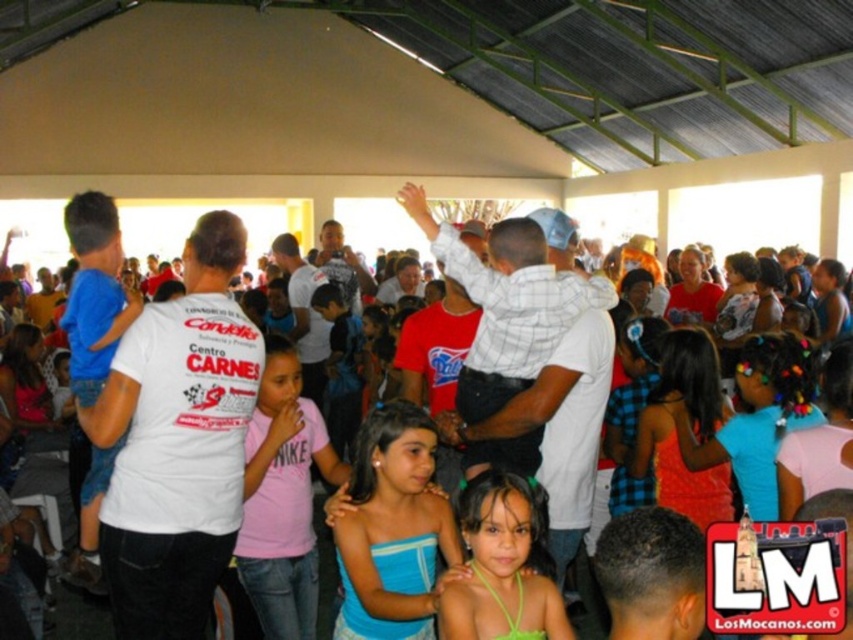
You are standing at the entrance of the pavilion and want to find the blue fabric dress at center. According to the coordinates provided, in which direction should you look to locate it?

The blue fabric dress at center is located at coordinates point (392, 529), so you should look towards the center of the pavilion to find it.

You are at the event and want to take a photo of both the blue fabric dress at center and the white cotton shirt at center. Can you see both clearly in the same photo without any obstruction?

The blue fabric dress at center is in front of the white cotton shirt at center, so the white cotton shirt at center might be partially obscured by the blue fabric dress at center in the photo.